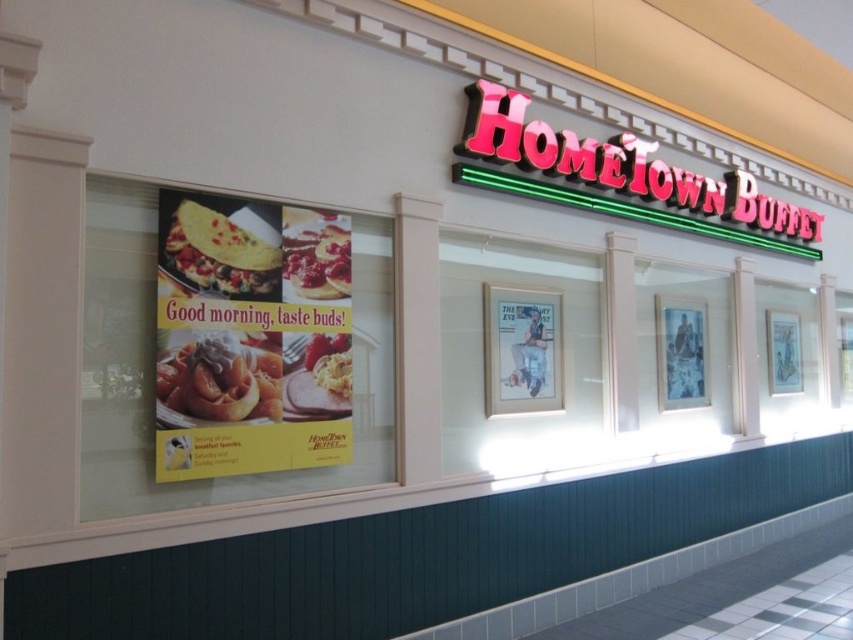
You are a food critic evaluating the presentation of dishes at HomeTown Buffet. You observe the golden waffle at center and the smooth white pancake at center on a plate. Which dish has a greater width?

The golden waffle at center has a greater width than the smooth white pancake at center, as stated in the description.